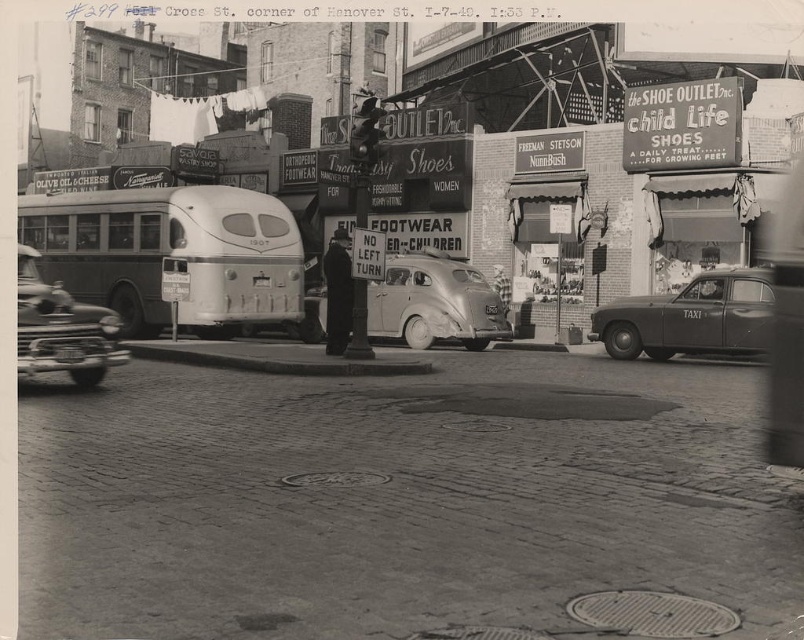
You are a pedestrian standing at the corner of Cross St. and Hanover St. looking at the scene. Which vehicle is closer to you, the matte black taxi at right or the shiny chrome sedan at lower left?

The matte black taxi at right is closer to you than the shiny chrome sedan at lower left because it is further to the viewer.

You are standing at the intersection of Cross St. and Hanover St. in this historical photo. There are two points marked on the image. Which point is closer to you, point 1 at coordinates (419, 337) or point 2 at coordinates (17, 324)?

Point 1 at coordinates (419, 337) is closer to you because it is further to the viewer than point 2 at coordinates (17, 324).